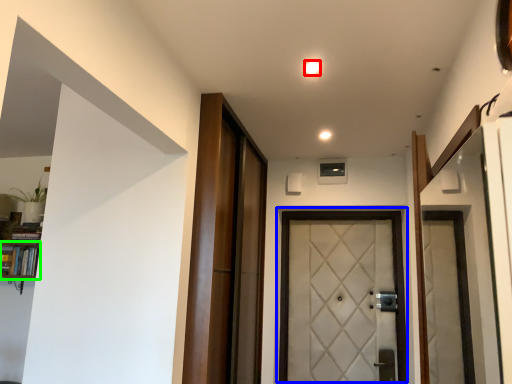
Question: Which object is the farthest from light (highlighted by a red box)? Choose among these: door (highlighted by a blue box) or bookshelf (highlighted by a green box).

Choices:
 (A) door
 (B) bookshelf

Answer: (B)